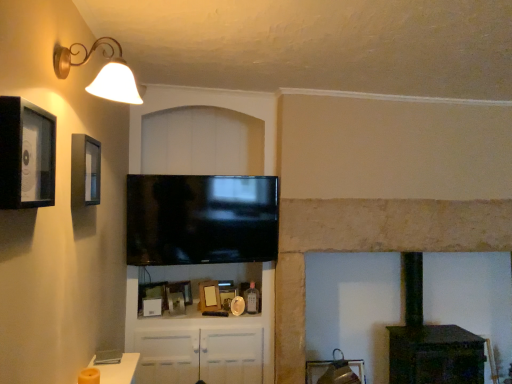
Image resolution: width=512 pixels, height=384 pixels. I want to click on black glossy flat-screen tv at center, so click(x=201, y=219).

Describe the element at coordinates (227, 296) in the screenshot. I see `wooden picture frame at center, the first picture frame when ordered from back to front` at that location.

Find the location of `stone fireplace at center`. stone fireplace at center is located at coordinates (369, 247).

Measure the distance between point (92, 141) and camera.

The depth of point (92, 141) is 6.13 feet.

What do you see at coordinates (85, 170) in the screenshot? I see `black matte picture frame at upper left, arranged as the 4th picture frame when ordered from the bottom` at bounding box center [85, 170].

Consider the image. How much space does wooden photo frame at center, which appears as the third picture frame when viewed from the top, occupy vertically?

23.34 centimeters.

The height and width of the screenshot is (384, 512). I want to click on gold metallic wall sconce at upper left, so click(102, 73).

Is black matte picture frame at upper left, arranged as the 4th picture frame when ordered from the bottom, thinner than wooden picture frame at center, placed as the 2th picture frame when sorted from bottom to top?

Yes.

Which point is more forward, (91, 146) or (169, 311)?

The point (91, 146) is closer to the camera.

Could you tell me if black matte picture frame at upper left, marked as the second picture frame in a front-to-back arrangement, is turned towards wooden picture frame at center, which is counted as the 4th picture frame, starting from the top?

No, black matte picture frame at upper left, marked as the second picture frame in a front-to-back arrangement, is not facing towards wooden picture frame at center, which is counted as the 4th picture frame, starting from the top.

Between black matte picture frame at upper left, the second picture frame in the top-to-bottom sequence, and wooden picture frame at center, which is counted as the 4th picture frame, starting from the top, which one is positioned in front?

black matte picture frame at upper left, the second picture frame in the top-to-bottom sequence, is more forward.

Which object is wider, black matte picture frame at left, marked as the 5th picture frame in a back-to-front arrangement, or wooden picture frame at center, marked as the fifth picture frame in a top-to-bottom arrangement?

wooden picture frame at center, marked as the fifth picture frame in a top-to-bottom arrangement.

From the image's perspective, is black matte picture frame at left, which is counted as the 5th picture frame, starting from the bottom, located above or below wooden picture frame at center, marked as the fifth picture frame in a top-to-bottom arrangement?

black matte picture frame at left, which is counted as the 5th picture frame, starting from the bottom, is above wooden picture frame at center, marked as the fifth picture frame in a top-to-bottom arrangement.

Considering the relative sizes of black matte picture frame at left, the 1th picture frame when ordered from front to back, and wooden picture frame at center, marked as the fifth picture frame in a top-to-bottom arrangement, in the image provided, is black matte picture frame at left, the 1th picture frame when ordered from front to back, shorter than wooden picture frame at center, marked as the fifth picture frame in a top-to-bottom arrangement,?

In fact, black matte picture frame at left, the 1th picture frame when ordered from front to back, may be taller than wooden picture frame at center, marked as the fifth picture frame in a top-to-bottom arrangement.

Looking at the image, does wooden photo frame at center, which appears as the third picture frame when viewed from the top, seem bigger or smaller compared to gold metallic wall sconce at upper left?

Considering their sizes, wooden photo frame at center, which appears as the third picture frame when viewed from the top, takes up less space than gold metallic wall sconce at upper left.

Is wooden photo frame at center, which appears as the third picture frame when viewed from the front, taller than gold metallic wall sconce at upper left?

Correct, wooden photo frame at center, which appears as the third picture frame when viewed from the front, is much taller as gold metallic wall sconce at upper left.

From a real-world perspective, is wooden photo frame at center, which appears as the third picture frame when viewed from the top, on top of gold metallic wall sconce at upper left?

Incorrect, from a real-world perspective, wooden photo frame at center, which appears as the third picture frame when viewed from the top, is lower than gold metallic wall sconce at upper left.

Considering the sizes of objects dark green wood stove at lower right and black matte picture frame at left, which is counted as the 5th picture frame, starting from the bottom, in the image provided, who is taller, dark green wood stove at lower right or black matte picture frame at left, which is counted as the 5th picture frame, starting from the bottom,?

Standing taller between the two is dark green wood stove at lower right.

Between dark green wood stove at lower right and black matte picture frame at left, marked as the 5th picture frame in a back-to-front arrangement, which one has smaller width?

Thinner between the two is black matte picture frame at left, marked as the 5th picture frame in a back-to-front arrangement.

Would you say dark green wood stove at lower right contains black matte picture frame at left, marked as the 5th picture frame in a back-to-front arrangement?

No, dark green wood stove at lower right does not contain black matte picture frame at left, marked as the 5th picture frame in a back-to-front arrangement.

From a real-world perspective, does black matte picture frame at upper left, marked as the second picture frame in a front-to-back arrangement, sit lower than stone fireplace at center?

No.

Which object is positioned more to the left, black matte picture frame at upper left, arranged as the 4th picture frame when ordered from the bottom, or stone fireplace at center?

black matte picture frame at upper left, arranged as the 4th picture frame when ordered from the bottom, is more to the left.

Is black matte picture frame at upper left, the fourth picture frame in the back-to-front sequence, inside or outside of stone fireplace at center?

The correct answer is: outside.

Which of these two, gold metallic wall sconce at upper left or black matte picture frame at left, marked as the 5th picture frame in a back-to-front arrangement, is thinner?

Thinner between the two is black matte picture frame at left, marked as the 5th picture frame in a back-to-front arrangement.

Measure the distance between gold metallic wall sconce at upper left and black matte picture frame at left, which is the first picture frame in top-to-bottom order.

gold metallic wall sconce at upper left and black matte picture frame at left, which is the first picture frame in top-to-bottom order, are 14.60 inches apart.

Is gold metallic wall sconce at upper left turned away from black matte picture frame at left, marked as the 5th picture frame in a back-to-front arrangement?

No, gold metallic wall sconce at upper left is not facing the opposite direction of black matte picture frame at left, marked as the 5th picture frame in a back-to-front arrangement.

Is gold metallic wall sconce at upper left surrounding black matte picture frame at left, which is counted as the 5th picture frame, starting from the bottom?

No, gold metallic wall sconce at upper left does not contain black matte picture frame at left, which is counted as the 5th picture frame, starting from the bottom.

Is stone fireplace at center aimed at dark green wood stove at lower right?

Yes, stone fireplace at center faces towards dark green wood stove at lower right.

Is dark green wood stove at lower right surrounded by stone fireplace at center?

That's correct, dark green wood stove at lower right is inside stone fireplace at center.

Which is more to the left, stone fireplace at center or dark green wood stove at lower right?

stone fireplace at center is more to the left.

From the image's perspective, count 2nd picture frames upward from the wooden picture frame at center, which is counted as the 4th picture frame, starting from the top, and point to it. Please provide its 2D coordinates.

[(85, 170)]

From the wooden picture frame at center, the first picture frame when ordered from back to front, count 4th picture frames forward and point to it. Please provide its 2D coordinates.

[(26, 155)]

From the image, which object appears to be farther from gold metallic wall sconce at upper left, dark green wood stove at lower right or wooden photo frame at center, which appears as the third picture frame when viewed from the front?

Among the two, dark green wood stove at lower right is located further to gold metallic wall sconce at upper left.

Which object lies further to the anchor point dark green wood stove at lower right, black matte picture frame at upper left, arranged as the 4th picture frame when ordered from the bottom, or wooden picture frame at center, marked as the fifth picture frame in a top-to-bottom arrangement?

black matte picture frame at upper left, arranged as the 4th picture frame when ordered from the bottom, is positioned further to the anchor dark green wood stove at lower right.

Estimate the real-world distances between objects in this image. Which object is closer to stone fireplace at center, wooden picture frame at center, marked as the fifth picture frame in a top-to-bottom arrangement, or wooden picture frame at center, the 4th picture frame from the front?

wooden picture frame at center, marked as the fifth picture frame in a top-to-bottom arrangement, lies closer to stone fireplace at center than the other object.

Based on their spatial positions, is gold metallic wall sconce at upper left or black glossy flat-screen tv at center closer to black matte picture frame at left, which is counted as the 5th picture frame, starting from the bottom?

gold metallic wall sconce at upper left.

From the image, which object appears to be nearer to wooden picture frame at center, marked as the fifth picture frame in a top-to-bottom arrangement, stone fireplace at center or wooden picture frame at center, placed as the 2th picture frame when sorted from bottom to top?

wooden picture frame at center, placed as the 2th picture frame when sorted from bottom to top, lies closer to wooden picture frame at center, marked as the fifth picture frame in a top-to-bottom arrangement, than the other object.

Which object lies nearer to the anchor point black matte picture frame at upper left, the second picture frame in the top-to-bottom sequence, gold metallic wall sconce at upper left or black matte picture frame at left, the 1th picture frame when ordered from front to back?

gold metallic wall sconce at upper left is closer to black matte picture frame at upper left, the second picture frame in the top-to-bottom sequence.

Which object lies further to the anchor point wooden photo frame at center, the third picture frame ordered from the bottom, black matte picture frame at left, the 1th picture frame when ordered from front to back, or stone fireplace at center?

The object further to wooden photo frame at center, the third picture frame ordered from the bottom, is black matte picture frame at left, the 1th picture frame when ordered from front to back.

When comparing their distances from gold metallic wall sconce at upper left, does black matte picture frame at upper left, arranged as the 4th picture frame when ordered from the bottom, or dark green wood stove at lower right seem further?

dark green wood stove at lower right is further to gold metallic wall sconce at upper left.

The width and height of the screenshot is (512, 384). Find the location of `stove between black matte picture frame at left, which is the first picture frame in top-to-bottom order, and wooden picture frame at center, the 4th picture frame from the front, in the front-back direction`. stove between black matte picture frame at left, which is the first picture frame in top-to-bottom order, and wooden picture frame at center, the 4th picture frame from the front, in the front-back direction is located at coordinates (430, 341).

The image size is (512, 384). Find the location of `light fixture located between black matte picture frame at left, which is the first picture frame in top-to-bottom order, and black glossy flat-screen tv at center in the depth direction`. light fixture located between black matte picture frame at left, which is the first picture frame in top-to-bottom order, and black glossy flat-screen tv at center in the depth direction is located at coordinates (102, 73).

Identify the location of television between black matte picture frame at upper left, the fourth picture frame in the back-to-front sequence, and wooden picture frame at center, which ranks as the 2th picture frame in back-to-front order, in the front-back direction. The image size is (512, 384). (201, 219).

This screenshot has height=384, width=512. I want to click on fireplace between black matte picture frame at upper left, marked as the second picture frame in a front-to-back arrangement, and dark green wood stove at lower right, so click(369, 247).